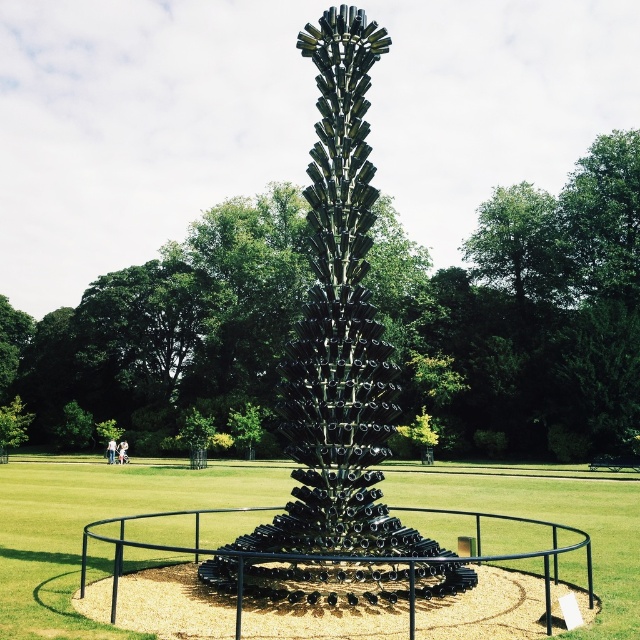
Question: Estimate the real-world distances between objects in this image. Which object is closer to the black glass sculpture at center?

Choices:
 (A) metallic sculpture at center
 (B) shiny metallic sculpture at center

Answer: (B)

Question: Is metallic sculpture at center to the left of shiny metallic sculpture at center from the viewer's perspective?

Choices:
 (A) yes
 (B) no

Answer: (A)

Question: Which object is closer to the camera taking this photo?

Choices:
 (A) metallic sculpture at center
 (B) black glass sculpture at center
 (C) shiny metallic sculpture at center

Answer: (C)

Question: Which object is the closest to the black glass sculpture at center?

Choices:
 (A) metallic sculpture at center
 (B) shiny metallic sculpture at center

Answer: (B)

Question: Is metallic sculpture at center thinner than black glass sculpture at center?

Choices:
 (A) no
 (B) yes

Answer: (A)

Question: Considering the relative positions of metallic sculpture at center and black glass sculpture at center in the image provided, where is metallic sculpture at center located with respect to black glass sculpture at center?

Choices:
 (A) above
 (B) below

Answer: (A)